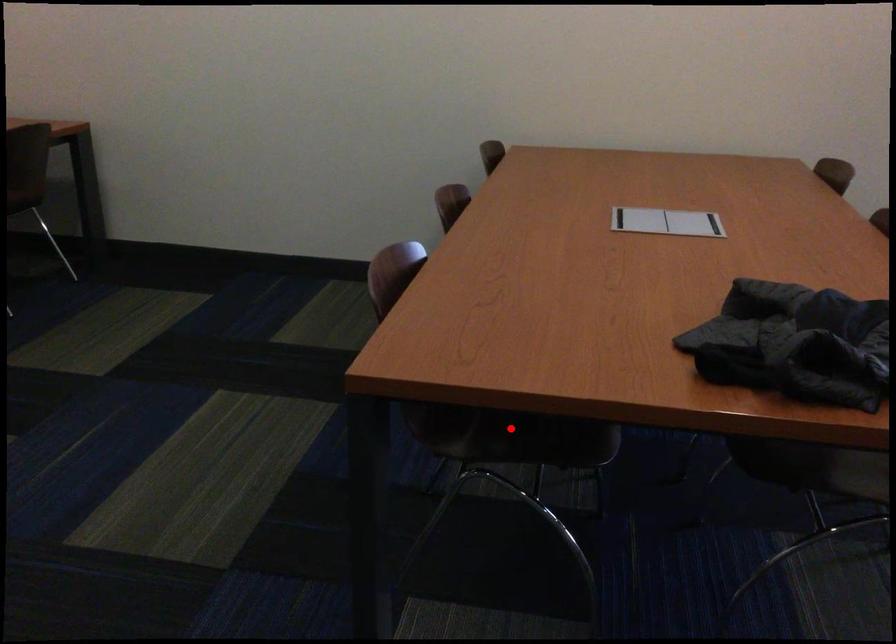
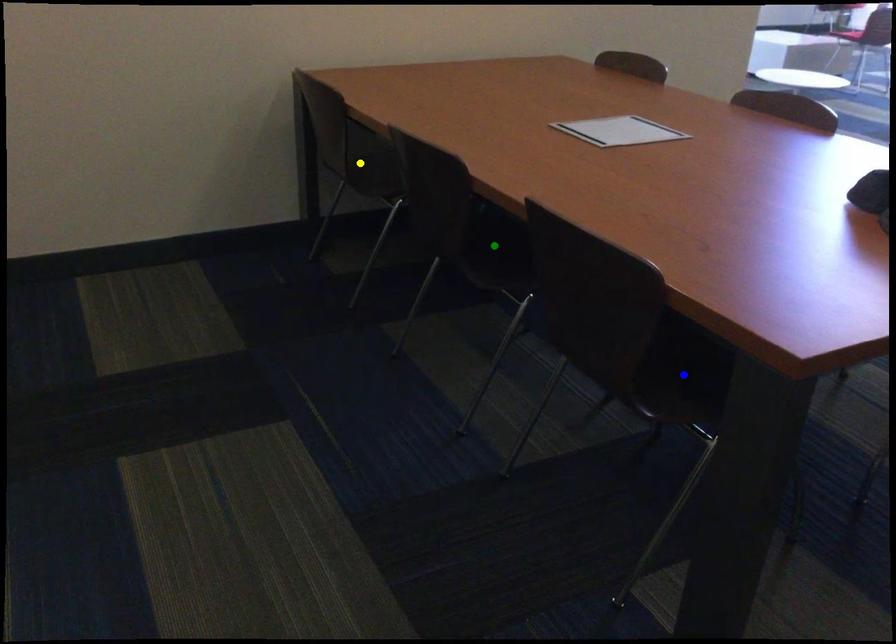
Question: I am providing you with two images of the same scene from different viewpoints. A red point is marked on the first image. You are given multiple points on the second image. Can you choose the point in image 2 that corresponds to the point in image 1?

Choices:
 (A) blue point
 (B) green point
 (C) yellow point

Answer: (A)